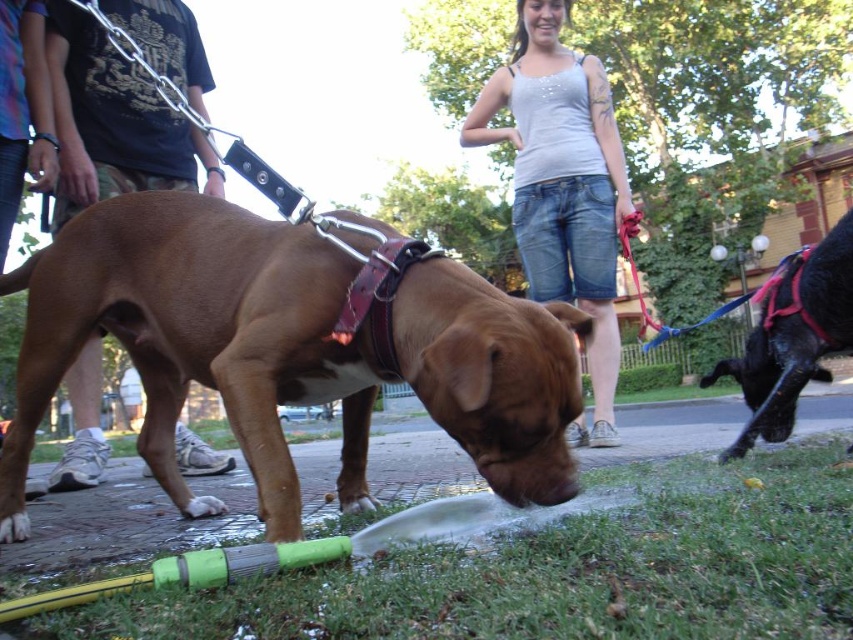
Question: Which point is closer to the camera?

Choices:
 (A) shiny black dog at right
 (B) brown leather dog at center
 (C) denim shorts at center
 (D) brown leather leash at left

Answer: (B)

Question: Considering the real-world distances, which object is farthest from the brown leather leash at left?

Choices:
 (A) denim shorts at center
 (B) brown leather dog at center
 (C) shiny black dog at right

Answer: (C)

Question: Considering the relative positions of denim shorts at center and brown leather leash at left in the image provided, where is denim shorts at center located with respect to brown leather leash at left?

Choices:
 (A) left
 (B) right

Answer: (B)

Question: Is brown leather dog at center above brown leather leash at left?

Choices:
 (A) yes
 (B) no

Answer: (B)

Question: Based on their relative distances, which object is farther from the denim shorts at center?

Choices:
 (A) shiny black dog at right
 (B) brown leather leash at left

Answer: (B)

Question: Does brown leather dog at center have a greater width compared to denim shorts at center?

Choices:
 (A) no
 (B) yes

Answer: (B)